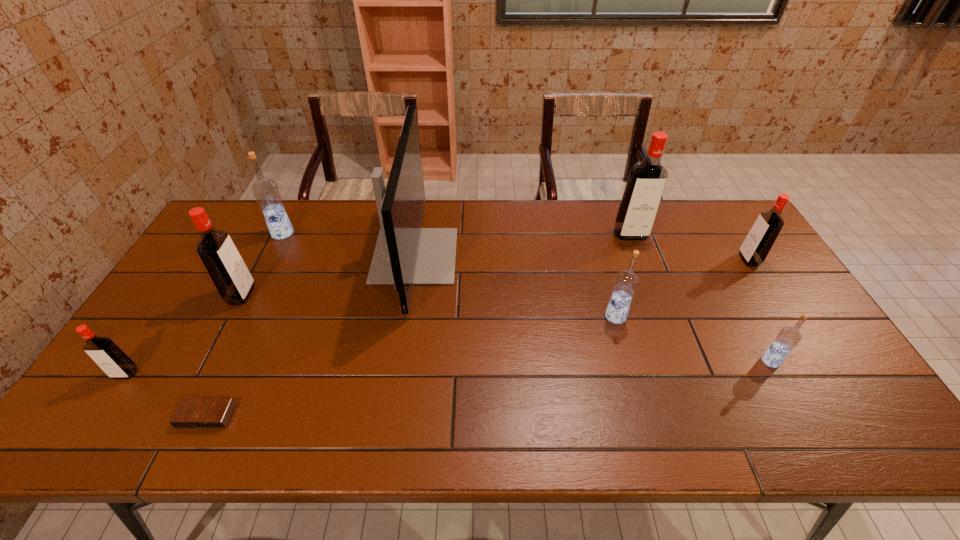
Find the location of a particular element. This screenshot has width=960, height=540. free location that satisfies the following two spatial constraints: 1. on the front and back of the third red vodka from right to left; 2. on the left side of the fourth vodka from left to right is located at coordinates (230, 316).

You are a GUI agent. You are given a task and a screenshot of the screen. Output one action in this format:
    pyautogui.click(x=<x>, y=<y>)
    Task: Click on the free location that satisfies the following two spatial constraints: 1. on the screen of the computer monitor; 2. on the front face of the alarm clock
    Image resolution: width=960 pixels, height=540 pixels.
    Given the screenshot: What is the action you would take?
    pyautogui.click(x=390, y=416)

Locate an element on the screen. The width and height of the screenshot is (960, 540). blank space that satisfies the following two spatial constraints: 1. on the front and back of the third object from right to left; 2. on the front and back of the fourth farthest vodka is located at coordinates (653, 295).

Identify the location of free space that satisfies the following two spatial constraints: 1. on the screen of the computer monitor; 2. on the front and back of the leftmost object. (396, 374).

I want to click on vacant position in the image that satisfies the following two spatial constraints: 1. on the front and back of the rightmost blue vodka; 2. on the right side of the second biggest red vodka, so pyautogui.click(x=206, y=361).